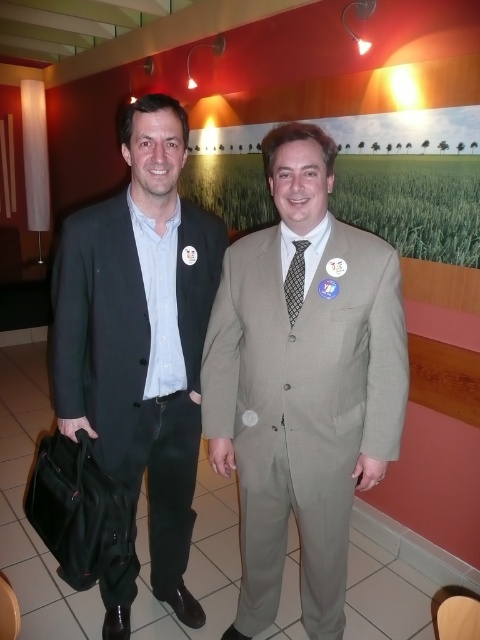
Who is lower down, light beige suit at center or black textured tie at center?

light beige suit at center is below.

Is light beige suit at center thinner than black textured tie at center?

No, light beige suit at center is not thinner than black textured tie at center.

Who is more forward, (243, 468) or (299, 252)?

Positioned in front is point (299, 252).

This screenshot has width=480, height=640. I want to click on light beige suit at center, so click(x=302, y=385).

Consider the image. Does matte black suit at left have a smaller size compared to black textured tie at center?

No, matte black suit at left is not smaller than black textured tie at center.

Which is above, matte black suit at left or black textured tie at center?

black textured tie at center is above.

Describe the element at coordinates (141, 333) in the screenshot. The width and height of the screenshot is (480, 640). I see `matte black suit at left` at that location.

You are a GUI agent. You are given a task and a screenshot of the screen. Output one action in this format:
    pyautogui.click(x=<x>, y=<y>)
    Task: Click on the matte black suit at left
    
    Given the screenshot: What is the action you would take?
    pyautogui.click(x=141, y=333)

Does light beige suit at center have a smaller size compared to matte black suit at left?

Indeed, light beige suit at center has a smaller size compared to matte black suit at left.

Is light beige suit at center closer to the viewer compared to matte black suit at left?

Yes, light beige suit at center is closer to the viewer.

Is point (214, 433) farther from camera compared to point (154, 369)?

That is False.

The height and width of the screenshot is (640, 480). Identify the location of light beige suit at center. (302, 385).